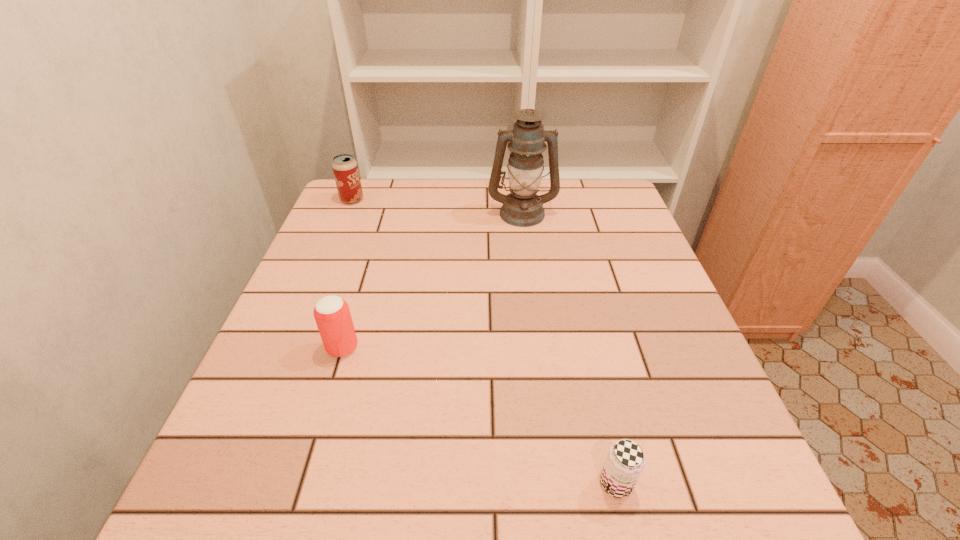
Find the location of a particular element. the tallest object is located at coordinates coord(522,207).

Find the location of a particular element. The height and width of the screenshot is (540, 960). the leftmost beer can is located at coordinates (345, 169).

What are the coordinates of `the farthest beer can` in the screenshot? It's located at (345, 169).

At what (x,y) coordinates should I click in order to perform the action: click on the third object from right to left. Please return your answer as a coordinate pair (x, y). The image size is (960, 540). Looking at the image, I should click on (332, 315).

Locate an element on the screen. The width and height of the screenshot is (960, 540). the third farthest object is located at coordinates (332, 315).

The width and height of the screenshot is (960, 540). I want to click on the nearest beer can, so coord(625,461).

The height and width of the screenshot is (540, 960). What are the coordinates of `the shortest object` in the screenshot? It's located at (625, 461).

Where is `free spot located on the left of the oil lamp`? This screenshot has width=960, height=540. free spot located on the left of the oil lamp is located at coordinates (348, 213).

Where is `blank area located 0.050m on the back of the leftmost beer can`? blank area located 0.050m on the back of the leftmost beer can is located at coordinates (358, 185).

Find the location of `vacant space situated 0.300m on the front of the second object from left to right`. vacant space situated 0.300m on the front of the second object from left to right is located at coordinates (287, 531).